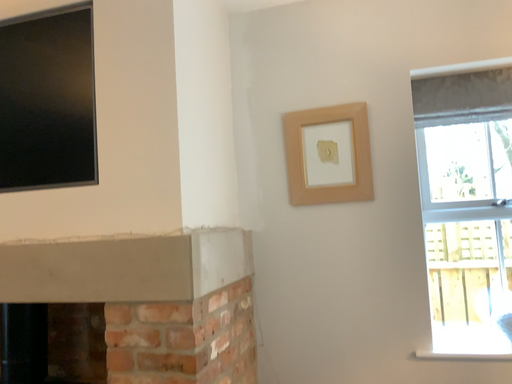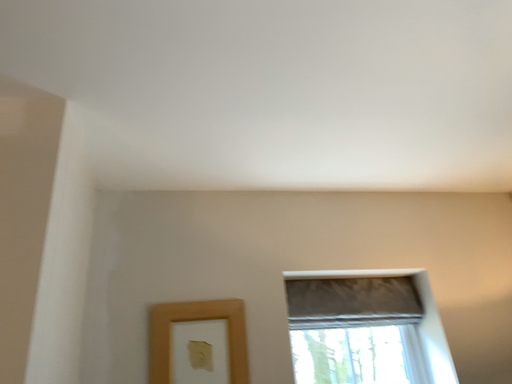
Question: Which way did the camera rotate in the video?

Choices:
 (A) rotated upward
 (B) rotated downward

Answer: (A)